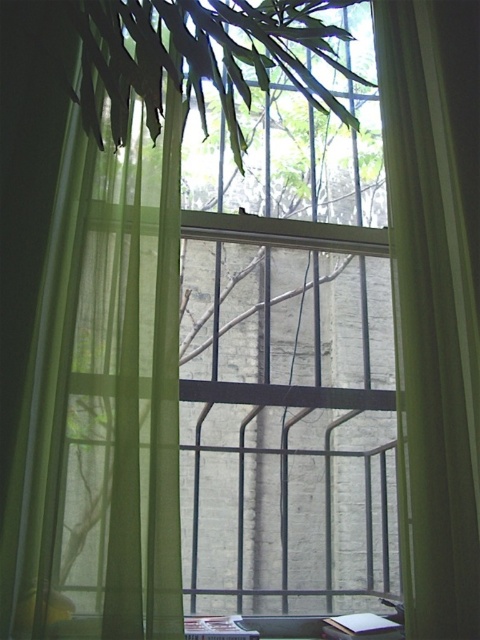
Question: Which object is the farthest from the white paper book at bottom right?

Choices:
 (A) green sheer curtain at center
 (B) green sheer curtain at left
 (C) white paper at bottom center

Answer: (B)

Question: Which object is the farthest from the green sheer curtain at center?

Choices:
 (A) green sheer curtain at left
 (B) white paper at bottom center
 (C) white paper book at bottom right

Answer: (B)

Question: Does green sheer curtain at left have a larger size compared to white paper book at bottom right?

Choices:
 (A) no
 (B) yes

Answer: (B)

Question: Can you confirm if green sheer curtain at center is positioned below white paper at bottom center?

Choices:
 (A) no
 (B) yes

Answer: (A)

Question: Is green sheer curtain at center closer to camera compared to white paper book at bottom right?

Choices:
 (A) no
 (B) yes

Answer: (B)

Question: Which object appears closest to the camera in this image?

Choices:
 (A) green sheer curtain at center
 (B) white paper book at bottom right
 (C) green sheer curtain at left

Answer: (C)